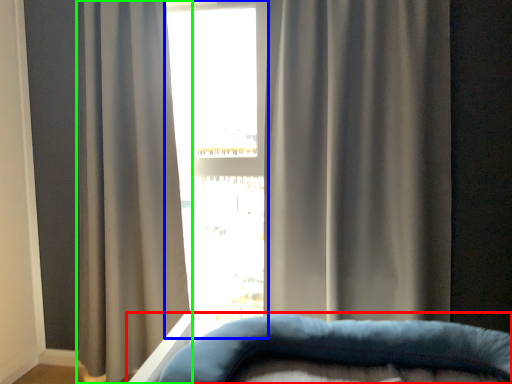
Question: Which object is positioned closest to furniture (highlighted by a red box)? Select from bay window (highlighted by a blue box) and curtain (highlighted by a green box).

Choices:
 (A) bay window
 (B) curtain

Answer: (B)